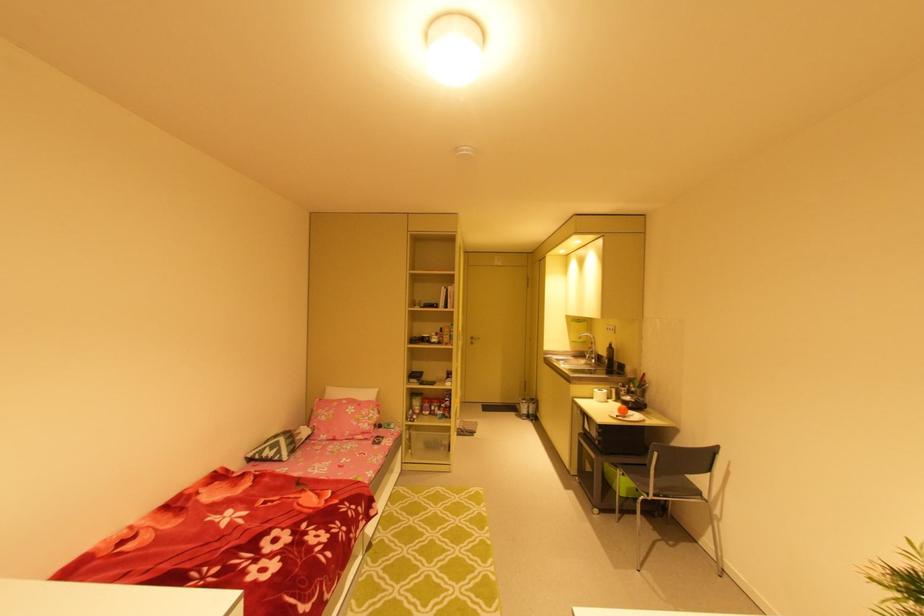
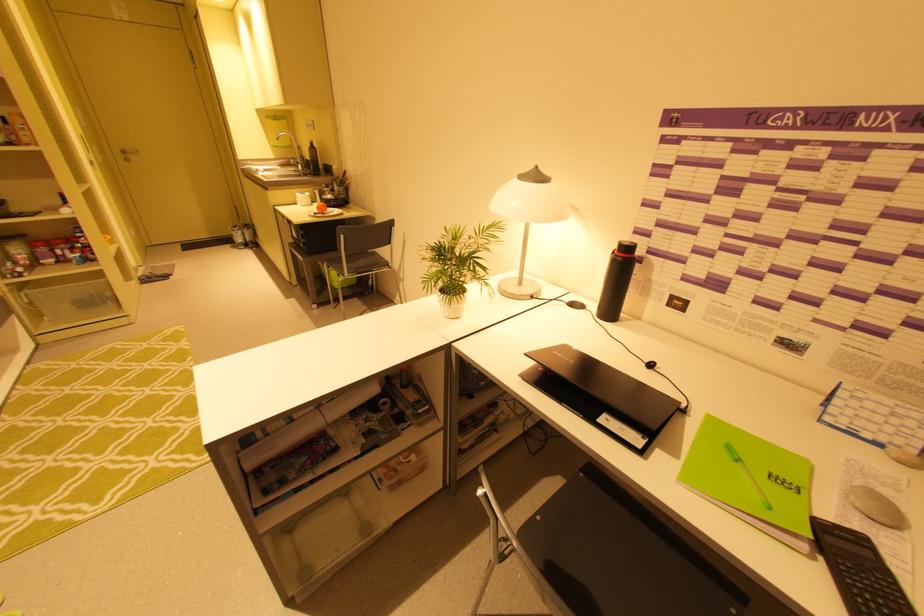
The point at [476,339] is marked in the first image. Where is the corresponding point in the second image?

(128, 152)